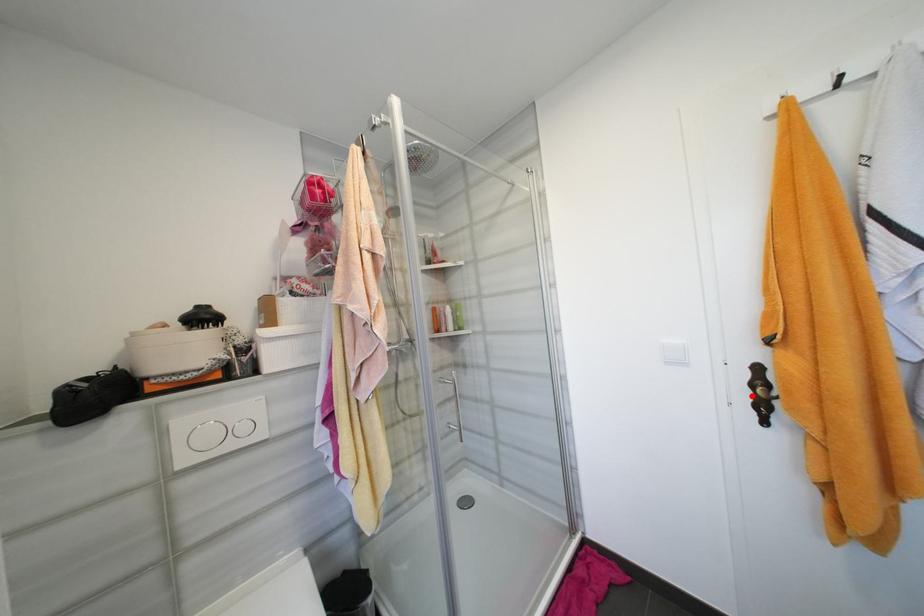
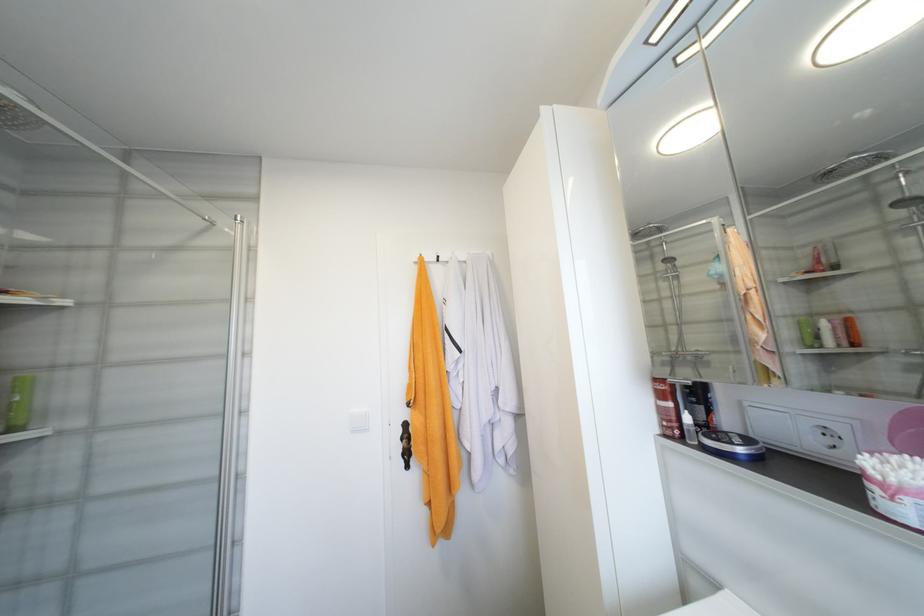
Where in the second image is the point corresponding to the highlighted location from the first image?

(405, 448)